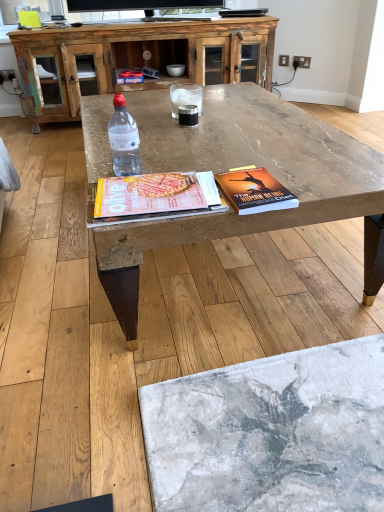
The height and width of the screenshot is (512, 384). What are the coordinates of `free space between black rubberized cup at center and transparent plastic bottle at center` in the screenshot? It's located at (166, 144).